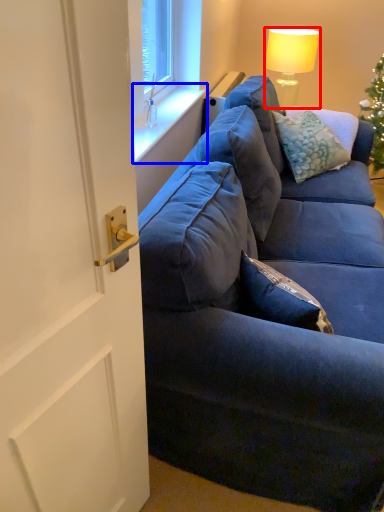
Question: Which point is closer to the camera, lamp (highlighted by a red box) or window sill (highlighted by a blue box)?

Choices:
 (A) lamp
 (B) window sill

Answer: (B)